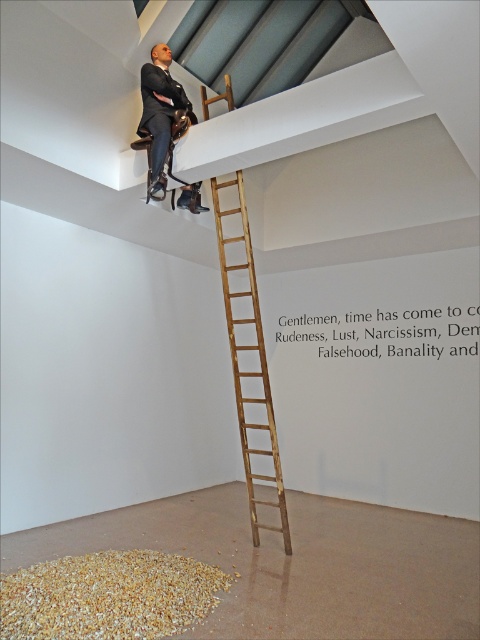
Question: Is brown rough grain at lower left to the right of matte black suit at upper center from the viewer's perspective?

Choices:
 (A) no
 (B) yes

Answer: (A)

Question: From the image, what is the correct spatial relationship of brown rough grain at lower left in relation to wooden ladder at upper center?

Choices:
 (A) below
 (B) above

Answer: (A)

Question: Which object is positioned farthest from the brown rough grain at lower left?

Choices:
 (A) matte black suit at upper center
 (B) wooden ladder at upper center

Answer: (A)

Question: Which object appears closest to the camera in this image?

Choices:
 (A) matte black suit at upper center
 (B) brown rough grain at lower left

Answer: (B)

Question: Where is wooden ladder at upper center located in relation to matte black suit at upper center in the image?

Choices:
 (A) below
 (B) above

Answer: (A)

Question: Which of the following is the farthest from the observer?

Choices:
 (A) (267, 502)
 (B) (100, 608)

Answer: (A)